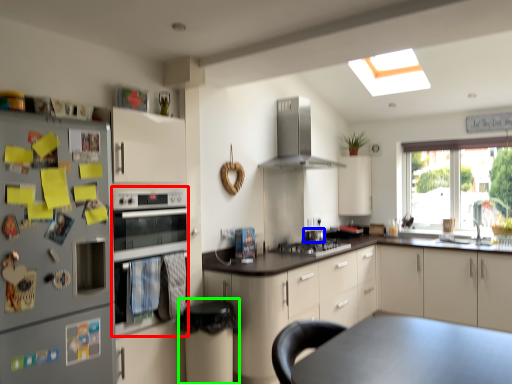
Question: Which is nearer to the oven (highlighted by a red box)? appliance (highlighted by a blue box) or bar stool (highlighted by a green box).

Choices:
 (A) appliance
 (B) bar stool

Answer: (B)